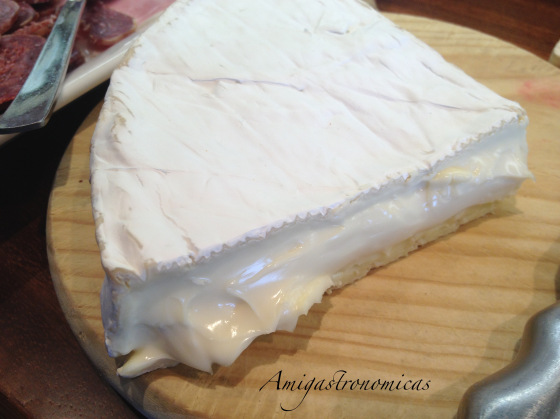
Image resolution: width=560 pixels, height=419 pixels. Find the location of `floor`. floor is located at coordinates (4, 402).